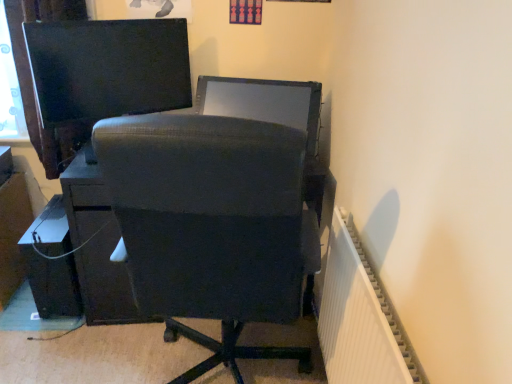
Question: Should I look upward or downward to see matte black monitor at upper left, which ranks as the 1th computer monitor in left-to-right order?

Choices:
 (A) down
 (B) up

Answer: (B)

Question: From the image's perspective, is matte black file cabinet at lower left above satin black monitor at center, the second computer monitor in the left-to-right sequence?

Choices:
 (A) no
 (B) yes

Answer: (A)

Question: Is there a large distance between matte black file cabinet at lower left and satin black monitor at center, which is counted as the 1th computer monitor, starting from the right?

Choices:
 (A) yes
 (B) no

Answer: (A)

Question: Does matte black file cabinet at lower left have a greater height compared to satin black monitor at center, the second computer monitor in the left-to-right sequence?

Choices:
 (A) no
 (B) yes

Answer: (B)

Question: Is matte black file cabinet at lower left at the left side of satin black monitor at center, which is counted as the 1th computer monitor, starting from the right?

Choices:
 (A) no
 (B) yes

Answer: (B)

Question: From a real-world perspective, is matte black file cabinet at lower left physically above satin black monitor at center, which is counted as the 1th computer monitor, starting from the right?

Choices:
 (A) yes
 (B) no

Answer: (B)

Question: Can you confirm if matte black file cabinet at lower left is thinner than satin black monitor at center, the second computer monitor in the left-to-right sequence?

Choices:
 (A) yes
 (B) no

Answer: (B)

Question: From the image's perspective, would you say white ribbed radiator at right is positioned over satin black monitor at center, which is counted as the 1th computer monitor, starting from the right?

Choices:
 (A) yes
 (B) no

Answer: (B)

Question: From the image's perspective, would you say white ribbed radiator at right is shown under satin black monitor at center, which is counted as the 1th computer monitor, starting from the right?

Choices:
 (A) yes
 (B) no

Answer: (A)

Question: Can you see white ribbed radiator at right touching satin black monitor at center, the second computer monitor in the left-to-right sequence?

Choices:
 (A) no
 (B) yes

Answer: (A)

Question: Does white ribbed radiator at right contain satin black monitor at center, the second computer monitor in the left-to-right sequence?

Choices:
 (A) no
 (B) yes

Answer: (A)

Question: From a real-world perspective, is white ribbed radiator at right physically above satin black monitor at center, the second computer monitor in the left-to-right sequence?

Choices:
 (A) yes
 (B) no

Answer: (B)

Question: Considering the relative sizes of white ribbed radiator at right and satin black monitor at center, which is counted as the 1th computer monitor, starting from the right, in the image provided, is white ribbed radiator at right taller than satin black monitor at center, which is counted as the 1th computer monitor, starting from the right,?

Choices:
 (A) no
 (B) yes

Answer: (B)

Question: Is matte black file cabinet at lower left to the left of matte black monitor at upper left, which appears as the 2th computer monitor when viewed from the right, from the viewer's perspective?

Choices:
 (A) yes
 (B) no

Answer: (A)